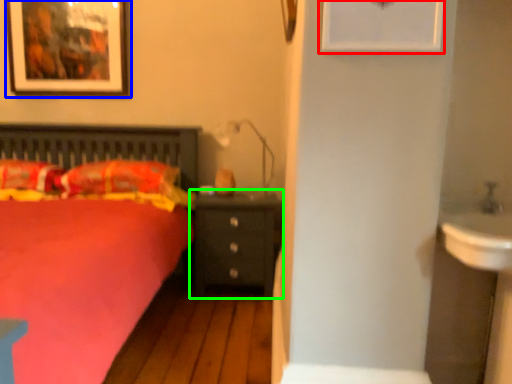
Question: Estimate the real-world distances between objects in this image. Which object is closer to picture frame (highlighted by a red box), picture frame (highlighted by a blue box) or nightstand (highlighted by a green box)?

Choices:
 (A) picture frame
 (B) nightstand

Answer: (B)